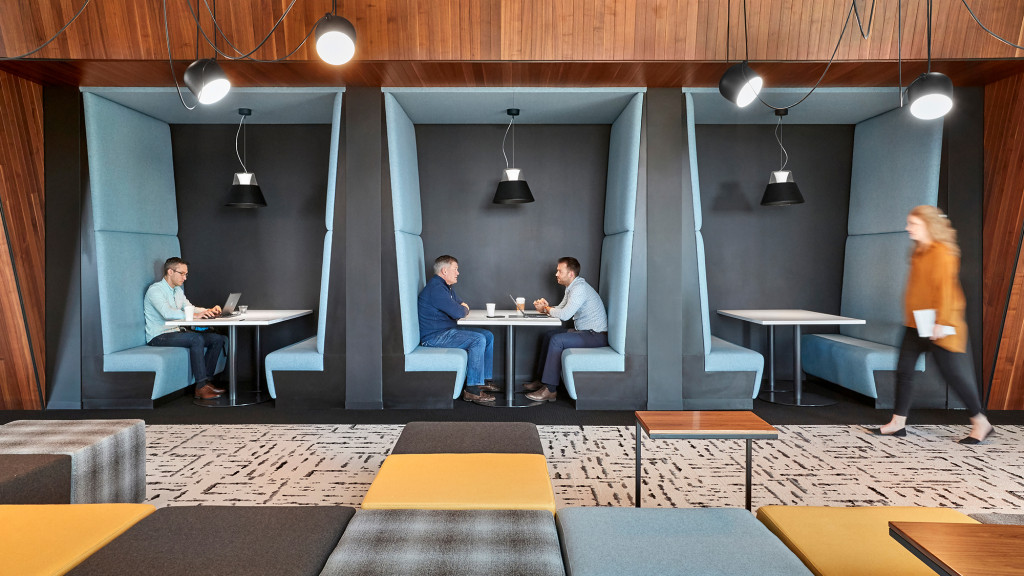
What are the coordinates of `cubby` in the screenshot? It's located at (669, 262).